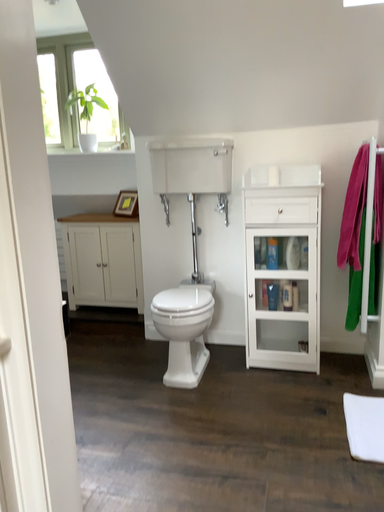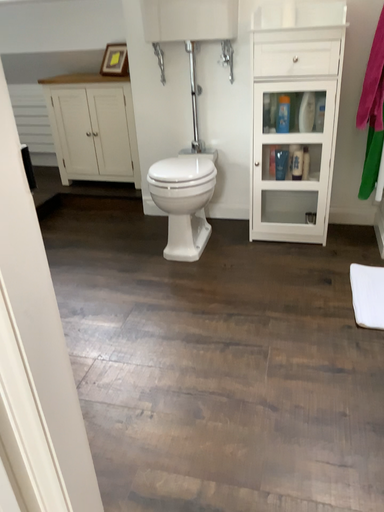
Question: Which way did the camera rotate in the video?

Choices:
 (A) rotated downward
 (B) rotated upward

Answer: (A)